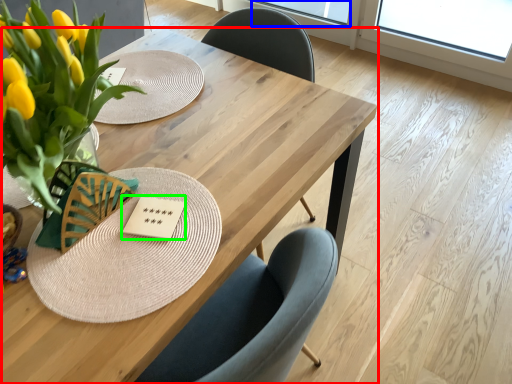
Question: Estimate the real-world distances between objects in this image. Which object is farther from table (highlighted by a red box), window screen (highlighted by a blue box) or card game (highlighted by a green box)?

Choices:
 (A) window screen
 (B) card game

Answer: (A)